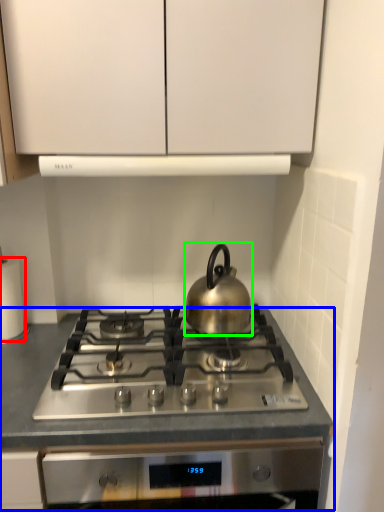
Question: Which object is positioned farthest from paper towel (highlighted by a red box)? Select from counter (highlighted by a blue box) and kettle (highlighted by a green box).

Choices:
 (A) counter
 (B) kettle

Answer: (B)